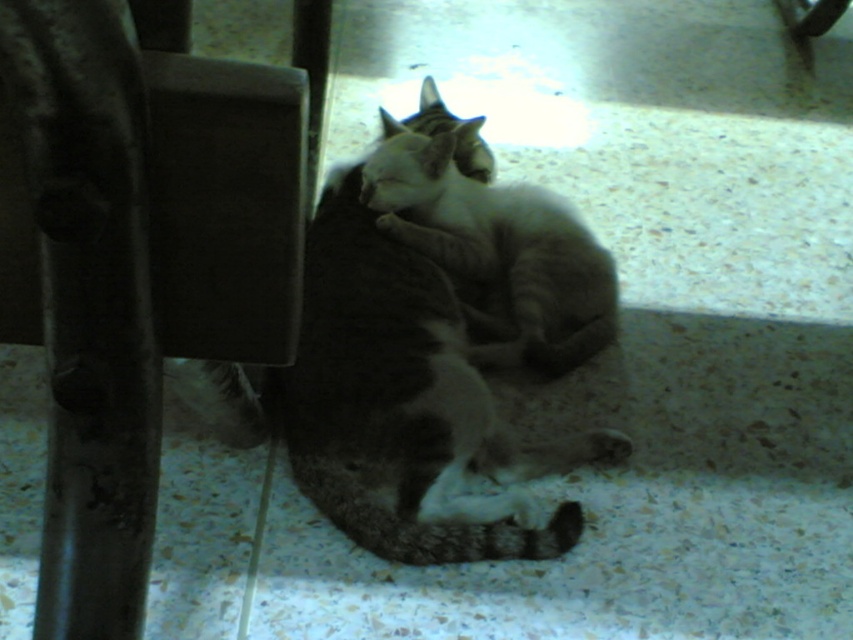
Question: Does metallic dark brown chair at left have a lesser width compared to tabby cat at center?

Choices:
 (A) no
 (B) yes

Answer: (B)

Question: Which point is closer to the camera?

Choices:
 (A) metallic dark brown chair at left
 (B) tabby cat at center

Answer: (A)

Question: Does tabby fur cat at center appear under tabby cat at center?

Choices:
 (A) no
 (B) yes

Answer: (B)

Question: Which of the following is the farthest from the observer?

Choices:
 (A) metallic dark brown chair at left
 (B) tabby fur cat at center

Answer: (B)

Question: Which point is closer to the camera taking this photo?

Choices:
 (A) (41, 218)
 (B) (422, 307)

Answer: (A)

Question: Is metallic dark brown chair at left to the left of tabby fur cat at center from the viewer's perspective?

Choices:
 (A) no
 (B) yes

Answer: (B)